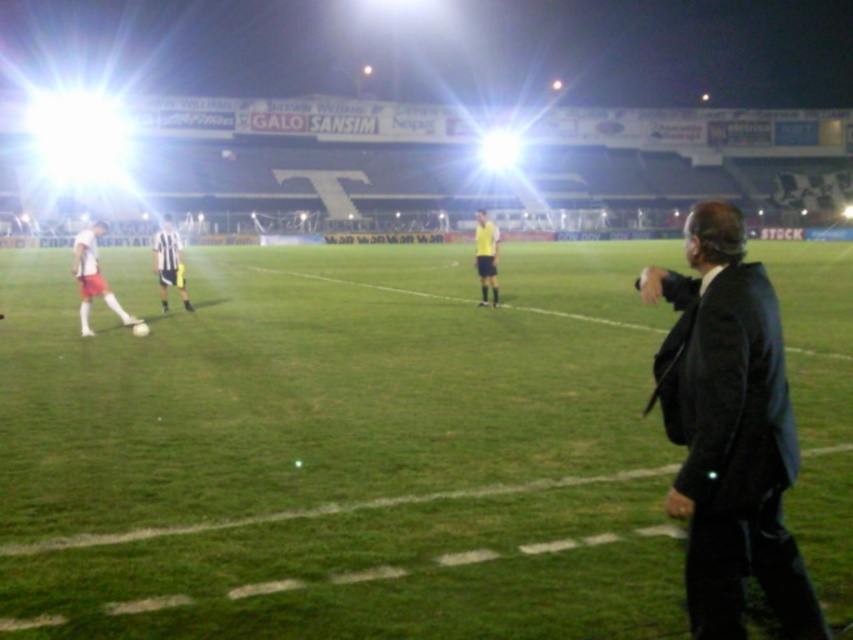
Question: Among these objects, which one is nearest to the camera?

Choices:
 (A) green grass at center
 (B) matte red shorts at left
 (C) striped jersey at left

Answer: (A)

Question: Is black matte suit at right bigger than striped jersey at left?

Choices:
 (A) no
 (B) yes

Answer: (A)

Question: Considering the real-world distances, which object is closest to the green grass at center?

Choices:
 (A) yellow jersey at center
 (B) striped jersey at left
 (C) matte red shorts at left

Answer: (C)

Question: In this image, where is black matte suit at right located relative to yellow jersey at center?

Choices:
 (A) left
 (B) right

Answer: (B)

Question: Can you confirm if green grass at center is smaller than striped jersey at left?

Choices:
 (A) no
 (B) yes

Answer: (B)

Question: Considering the real-world distances, which object is farthest from the green grass at center?

Choices:
 (A) yellow jersey at center
 (B) striped jersey at left

Answer: (B)